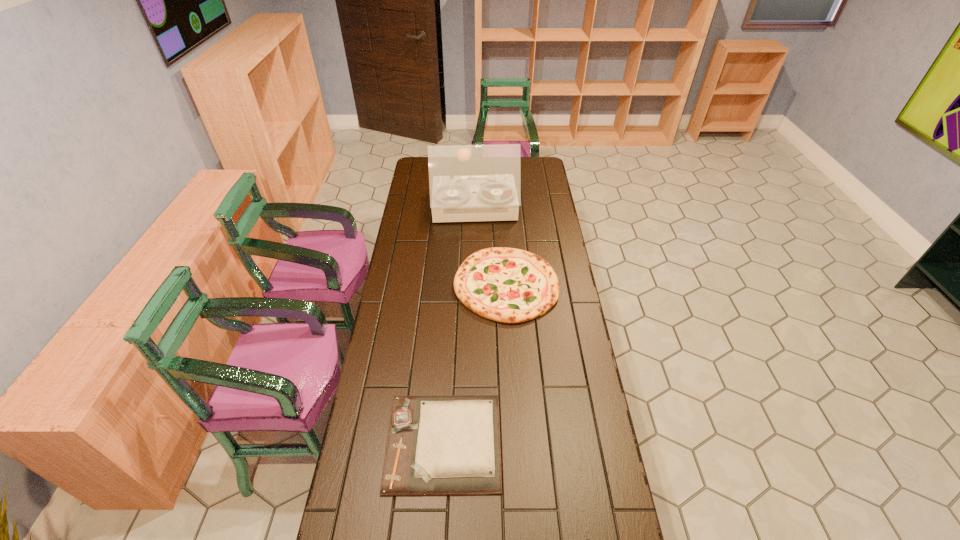
At what (x,y) coordinates should I click in order to perform the action: click on the tallest object. Please return your answer as a coordinate pair (x, y). The height and width of the screenshot is (540, 960). Looking at the image, I should click on (467, 183).

The image size is (960, 540). I want to click on record player, so click(467, 183).

You are a GUI agent. You are given a task and a screenshot of the screen. Output one action in this format:
    pyautogui.click(x=<x>, y=<y>)
    Task: Click on the pizza
    This screenshot has width=960, height=540.
    Given the screenshot: What is the action you would take?
    pyautogui.click(x=508, y=285)

The height and width of the screenshot is (540, 960). Find the location of `the third shortest object`. the third shortest object is located at coordinates (508, 285).

Where is `the third farthest object`? the third farthest object is located at coordinates (449, 444).

You are a GUI agent. You are given a task and a screenshot of the screen. Output one action in this format:
    pyautogui.click(x=<x>, y=<y>)
    Task: Click on the free space located on the right of the tallest object
    The height and width of the screenshot is (540, 960).
    Given the screenshot: What is the action you would take?
    pyautogui.click(x=542, y=209)

Find the location of a particular element. vacant space situated 0.250m on the left of the second farthest object is located at coordinates (395, 285).

Where is `vacant area situated 0.310m on the back of the clipboard`? The height and width of the screenshot is (540, 960). vacant area situated 0.310m on the back of the clipboard is located at coordinates (451, 325).

I want to click on record player that is positioned at the left edge, so click(x=467, y=183).

Identify the location of clipboard that is at the left edge. (449, 444).